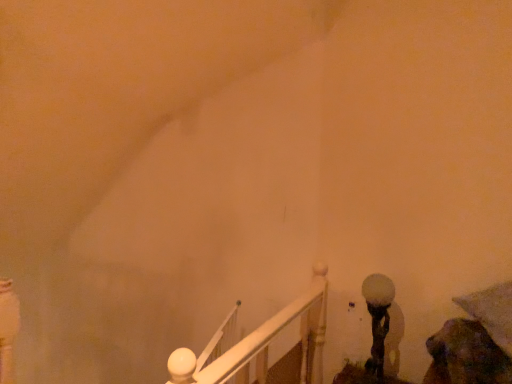
The width and height of the screenshot is (512, 384). What do you see at coordinates (378, 319) in the screenshot? I see `white frosted glass lamp at lower right` at bounding box center [378, 319].

You are a GUI agent. You are given a task and a screenshot of the screen. Output one action in this format:
    pyautogui.click(x=<x>, y=<y>)
    Task: Click on the white frosted glass lamp at lower right
    
    Given the screenshot: What is the action you would take?
    [x=378, y=319]

From the picture: Measure the distance between point [382,319] and camera.

Point [382,319] is 1.79 meters away from camera.

At what (x,y) coordinates should I click in order to perform the action: click on white frosted glass lamp at lower right. Please return your answer as a coordinate pair (x, y). Image resolution: width=512 pixels, height=384 pixels. Looking at the image, I should click on (378, 319).